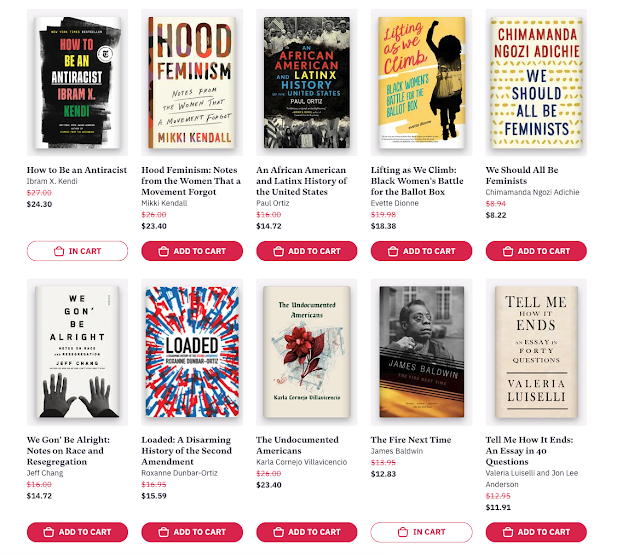
Locate an element on the screen. books is located at coordinates (88, 95), (214, 95), (301, 89), (434, 72), (518, 332), (425, 334), (207, 332), (45, 343).